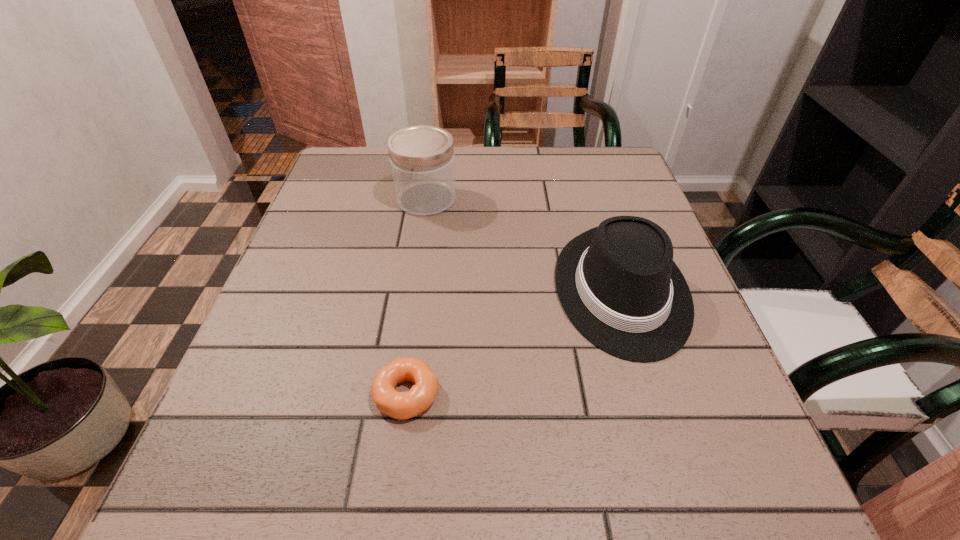
I want to click on unoccupied position between the doughnut and the farthest object, so click(417, 296).

Identify the location of vacant space in between the second tallest object and the shortest object. (515, 342).

This screenshot has height=540, width=960. What are the coordinates of `empty space between the farthest object and the shortest object` in the screenshot? It's located at (417, 296).

At what (x,y) coordinates should I click in order to perform the action: click on empty location between the jar and the second tallest object. Please return your answer as a coordinate pair (x, y). Looking at the image, I should click on (524, 245).

I want to click on vacant area between the doughnut and the fedora, so click(515, 342).

You are a GUI agent. You are given a task and a screenshot of the screen. Output one action in this format:
    pyautogui.click(x=<x>, y=<y>)
    Task: Click on the free space between the second shortest object and the jar
    
    Given the screenshot: What is the action you would take?
    pyautogui.click(x=524, y=245)

Where is `free space between the nearest object and the rightmost object`? The image size is (960, 540). free space between the nearest object and the rightmost object is located at coordinates (515, 342).

I want to click on free space between the shortest object and the tallest object, so 417,296.

Locate which object ranks in proximity to the tallest object. Please provide its 2D coordinates. Your answer should be formatted as a tuple, i.e. [(x, y)], where the tuple contains the x and y coordinates of a point satisfying the conditions above.

[(618, 284)]

Identify which object is located as the nearest to the shortest object. Please provide its 2D coordinates. Your answer should be formatted as a tuple, i.e. [(x, y)], where the tuple contains the x and y coordinates of a point satisfying the conditions above.

[(618, 284)]